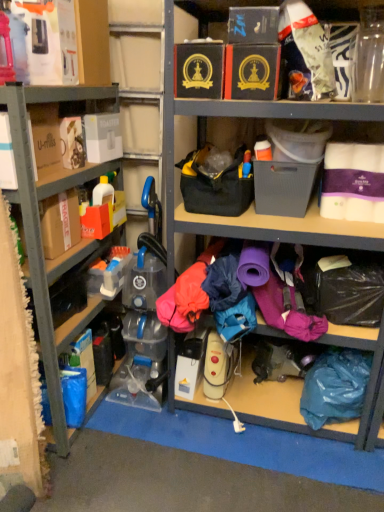
Question: Considering the positions of black cardboard box at upper center, placed as the 3th storage box when sorted from left to right, and matte black box at upper center, which appears as the 2th storage box when viewed from the right, in the image, is black cardboard box at upper center, placed as the 3th storage box when sorted from left to right, bigger or smaller than matte black box at upper center, which appears as the 2th storage box when viewed from the right,?

Choices:
 (A) big
 (B) small

Answer: (B)

Question: Is black cardboard box at upper center, arranged as the 3th storage box when viewed from the right, taller or shorter than matte black box at upper center, marked as the 4th storage box in a left-to-right arrangement?

Choices:
 (A) short
 (B) tall

Answer: (A)

Question: Estimate the real-world distances between objects in this image. Which object is farther from the teal fabric bag at lower right?

Choices:
 (A) black cardboard box at upper center, arranged as the 3th storage box when viewed from the right
 (B) white cardboard toaster at upper left, placed as the fifth storage box when sorted from right to left
 (C) matte plastic container at left
 (D) matte black box at upper center, marked as the 4th storage box in a left-to-right arrangement
 (E) gray plastic storage box at center, the 5th storage box when ordered from left to right

Answer: (B)

Question: Based on their relative distances, which object is nearer to the black cardboard box at upper center, arranged as the 3th storage box when viewed from the right?

Choices:
 (A) black leather book at upper center, arranged as the 2th storage box when viewed from the left
 (B) matte black box at upper center, marked as the 4th storage box in a left-to-right arrangement
 (C) gray plastic storage box at center, which is counted as the first storage box, starting from the right
 (D) matte plastic container at left
 (E) white cardboard toaster at upper left, placed as the fifth storage box when sorted from right to left

Answer: (B)